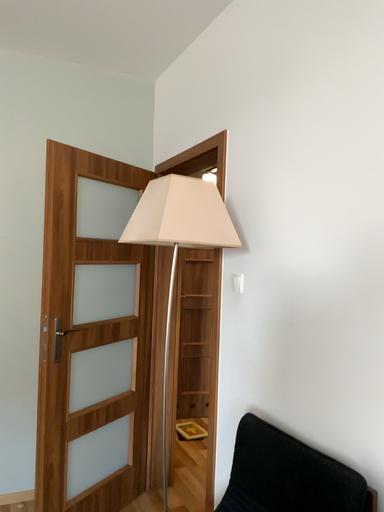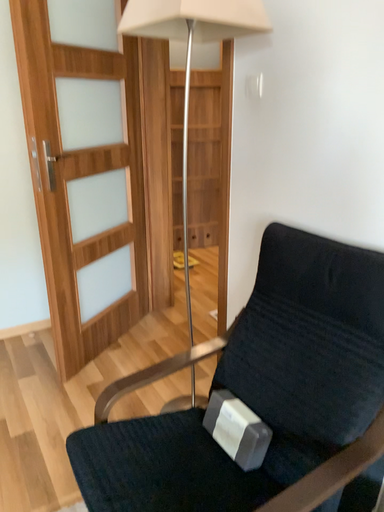
Question: How did the camera likely rotate when shooting the video?

Choices:
 (A) rotated upward
 (B) rotated downward

Answer: (B)